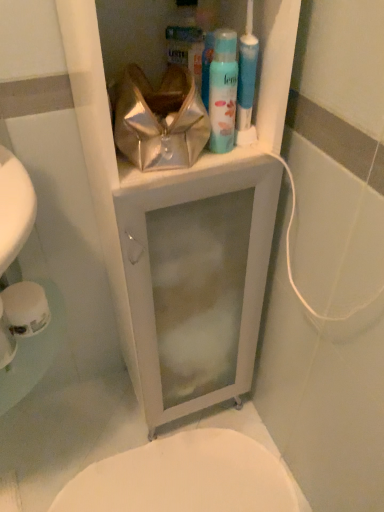
Describe the element at coordinates (160, 120) in the screenshot. I see `metallic gold pouch at upper center` at that location.

In order to face white glossy medicine cabinet at upper center, should I rotate leftwards or rightwards?

Turn left approximately 2.629 degrees to face it.

What do you see at coordinates (186, 477) in the screenshot? The width and height of the screenshot is (384, 512). I see `white glossy bidet at lower center` at bounding box center [186, 477].

I want to click on white matte toilet paper at lower left, so pos(25,308).

Locate an element on the screen. This screenshot has height=512, width=384. metallic gold pouch at upper center is located at coordinates (160, 120).

Is white matte toilet paper at lower left facing towards light blue matte shaving cream at upper center?

No, white matte toilet paper at lower left is not turned towards light blue matte shaving cream at upper center.

What are the coordinates of `shaving cream on the right of white matte toilet paper at lower left` in the screenshot? It's located at (223, 91).

Is white matte toilet paper at lower left bigger or smaller than light blue matte shaving cream at upper center?

Clearly, white matte toilet paper at lower left is larger in size than light blue matte shaving cream at upper center.

Can you confirm if white matte toilet paper at lower left is wider than light blue matte shaving cream at upper center?

Yes, white matte toilet paper at lower left is wider than light blue matte shaving cream at upper center.

Which is correct: light blue matte shaving cream at upper center is inside metallic gold pouch at upper center, or outside of it?

light blue matte shaving cream at upper center lies outside metallic gold pouch at upper center.

Would you consider light blue matte shaving cream at upper center to be distant from metallic gold pouch at upper center?

No, there isn't a large distance between light blue matte shaving cream at upper center and metallic gold pouch at upper center.

I want to click on pouch that is on the left side of light blue matte shaving cream at upper center, so click(x=160, y=120).

From a real-world perspective, who is located lower, light blue matte shaving cream at upper center or metallic gold pouch at upper center?

In real-world perspective, metallic gold pouch at upper center is lower.

From the picture: From a real-world perspective, which object rests below the other?

white glossy bidet at lower center is physically lower.

Is white glossy bidet at lower center looking in the opposite direction of metallic gold pouch at upper center?

No, white glossy bidet at lower center is not facing away from metallic gold pouch at upper center.

Considering the points (271, 504) and (202, 128), which point is in front, point (271, 504) or point (202, 128)?

The point (202, 128) is closer to the camera.

Considering the positions of objects white glossy bidet at lower center and metallic gold pouch at upper center in the image provided, who is more to the right, white glossy bidet at lower center or metallic gold pouch at upper center?

Positioned to the right is metallic gold pouch at upper center.

Is white glossy bidet at lower center smaller than white matte toilet paper at lower left?

No.

Does white glossy bidet at lower center touch white matte toilet paper at lower left?

No, white glossy bidet at lower center is not next to white matte toilet paper at lower left.

How distant is white glossy bidet at lower center from white matte toilet paper at lower left?

58.62 centimeters.

How many degrees apart are the facing directions of white glossy bidet at lower center and white matte toilet paper at lower left?

0.308 degrees separate the facing orientations of white glossy bidet at lower center and white matte toilet paper at lower left.

Is metallic gold pouch at upper center outside of white glossy medicine cabinet at upper center?

No, metallic gold pouch at upper center is not entirely external to white glossy medicine cabinet at upper center.

Are metallic gold pouch at upper center and white glossy medicine cabinet at upper center beside each other?

No.

Considering the sizes of objects metallic gold pouch at upper center and white glossy medicine cabinet at upper center in the image provided, who is shorter, metallic gold pouch at upper center or white glossy medicine cabinet at upper center?

With less height is metallic gold pouch at upper center.

Locate an element on the screen. This screenshot has width=384, height=512. pouch behind the white glossy medicine cabinet at upper center is located at coordinates (160, 120).

Is white matte toilet paper at lower left shorter than white glossy medicine cabinet at upper center?

Correct, white matte toilet paper at lower left is not as tall as white glossy medicine cabinet at upper center.

Is white matte toilet paper at lower left oriented away from white glossy medicine cabinet at upper center?

No, white matte toilet paper at lower left is not facing the opposite direction of white glossy medicine cabinet at upper center.

Based on the photo, considering the positions of objects white matte toilet paper at lower left and white glossy medicine cabinet at upper center in the image provided, who is more to the left, white matte toilet paper at lower left or white glossy medicine cabinet at upper center?

Positioned to the left is white matte toilet paper at lower left.

Find the location of a particular element. toilet paper on the left of the white glossy medicine cabinet at upper center is located at coordinates (25, 308).

Is point (17, 331) farther from camera compared to point (194, 500)?

No, it is in front of (194, 500).

Would you say white matte toilet paper at lower left contains white glossy bidet at lower center?

No, white glossy bidet at lower center is located outside of white matte toilet paper at lower left.

Is white matte toilet paper at lower left to the right of white glossy bidet at lower center from the viewer's perspective?

No, white matte toilet paper at lower left is not to the right of white glossy bidet at lower center.

From a real-world perspective, is white matte toilet paper at lower left located beneath white glossy bidet at lower center?

No.

In the image, there is a white matte toilet paper at lower left. Where is `shaving cream above it (from the image's perspective)`? Image resolution: width=384 pixels, height=512 pixels. shaving cream above it (from the image's perspective) is located at coordinates (223, 91).

Locate an element on the screen. The image size is (384, 512). pouch in front of the light blue matte shaving cream at upper center is located at coordinates (160, 120).

Considering their positions, is metallic gold pouch at upper center positioned closer to light blue matte shaving cream at upper center than white glossy bidet at lower center?

metallic gold pouch at upper center.

Considering their positions, is white matte toilet paper at lower left positioned closer to white glossy bidet at lower center than metallic gold pouch at upper center?

Based on the image, white matte toilet paper at lower left appears to be nearer to white glossy bidet at lower center.

Looking at the image, which one is located closer to white glossy medicine cabinet at upper center, white matte toilet paper at lower left or light blue matte shaving cream at upper center?

light blue matte shaving cream at upper center lies closer to white glossy medicine cabinet at upper center than the other object.

From the image, which object appears to be farther from light blue matte shaving cream at upper center, white glossy bidet at lower center or white glossy medicine cabinet at upper center?

Among the two, white glossy bidet at lower center is located further to light blue matte shaving cream at upper center.

Which object lies nearer to the anchor point light blue matte shaving cream at upper center, metallic gold pouch at upper center or white glossy medicine cabinet at upper center?

metallic gold pouch at upper center lies closer to light blue matte shaving cream at upper center than the other object.

From the image, which object appears to be farther from white glossy bidet at lower center, white glossy medicine cabinet at upper center or light blue matte shaving cream at upper center?

light blue matte shaving cream at upper center lies further to white glossy bidet at lower center than the other object.

When comparing their distances from metallic gold pouch at upper center, does white glossy bidet at lower center or white matte toilet paper at lower left seem closer?

white matte toilet paper at lower left lies closer to metallic gold pouch at upper center than the other object.

Which object lies further to the anchor point light blue matte shaving cream at upper center, white matte toilet paper at lower left or white glossy medicine cabinet at upper center?

Based on the image, white matte toilet paper at lower left appears to be further to light blue matte shaving cream at upper center.

Where is `pouch between light blue matte shaving cream at upper center and white glossy bidet at lower center in the up-down direction`? pouch between light blue matte shaving cream at upper center and white glossy bidet at lower center in the up-down direction is located at coordinates (160, 120).

The image size is (384, 512). Identify the location of toilet paper between light blue matte shaving cream at upper center and white glossy bidet at lower center from top to bottom. (25, 308).

What are the coordinates of `medicine cabinet between metallic gold pouch at upper center and white matte toilet paper at lower left in the up-down direction` in the screenshot? It's located at (179, 207).

I want to click on medicine cabinet between metallic gold pouch at upper center and white glossy bidet at lower center in the up-down direction, so (x=179, y=207).